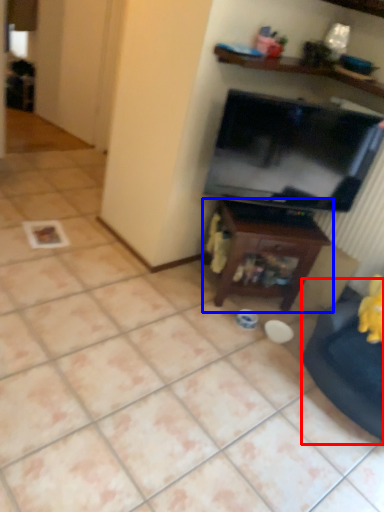
Question: Which point is further to the camera, swivel chair (highlighted by a red box) or table (highlighted by a blue box)?

Choices:
 (A) swivel chair
 (B) table

Answer: (B)